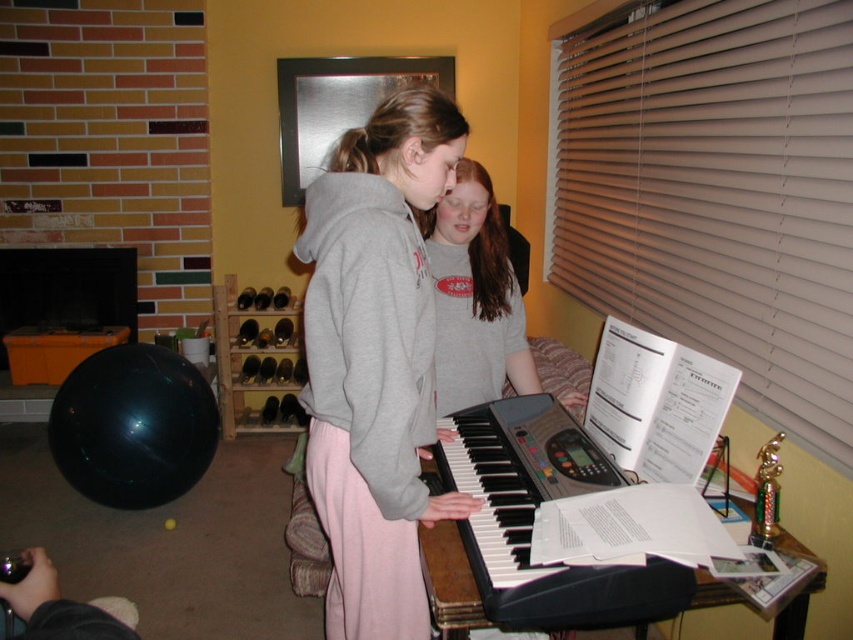
Question: Considering the relative positions of beige blinds at upper right and gray cotton shirt at center in the image provided, where is beige blinds at upper right located with respect to gray cotton shirt at center?

Choices:
 (A) below
 (B) above

Answer: (B)

Question: Can you confirm if gray sweatshirt at center is positioned to the right of black plastic keyboard at center?

Choices:
 (A) yes
 (B) no

Answer: (B)

Question: Which point is closer to the camera taking this photo?

Choices:
 (A) (630, 248)
 (B) (337, 444)
 (C) (520, 477)

Answer: (B)

Question: Which object appears farthest from the camera in this image?

Choices:
 (A) beige blinds at upper right
 (B) black plastic keyboard at center

Answer: (A)

Question: Is beige blinds at upper right positioned at the back of gray cotton shirt at center?

Choices:
 (A) yes
 (B) no

Answer: (B)

Question: Among these objects, which one is nearest to the camera?

Choices:
 (A) beige blinds at upper right
 (B) gray cotton shirt at center

Answer: (A)